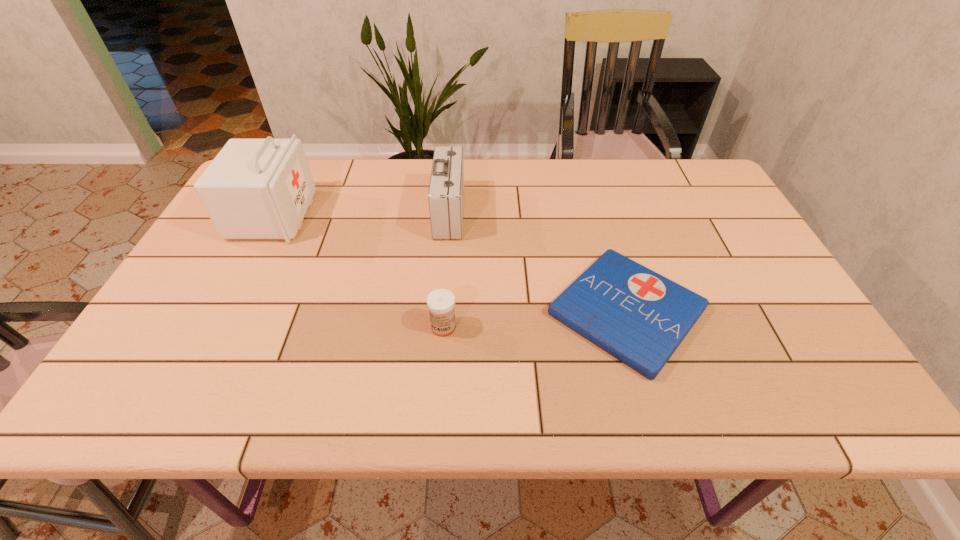
Select which object appears as the closest to the medicine. Please provide its 2D coordinates. Your answer should be formatted as a tuple, i.e. [(x, y)], where the tuple contains the x and y coordinates of a point satisfying the conditions above.

[(638, 316)]

Identify which first-aid kit is located as the nearest to the third tallest object. Please provide its 2D coordinates. Your answer should be formatted as a tuple, i.e. [(x, y)], where the tuple contains the x and y coordinates of a point satisfying the conditions above.

[(638, 316)]

The image size is (960, 540). What are the coordinates of `the first-aid kit object that ranks as the second closest to the medicine` in the screenshot? It's located at (446, 189).

Locate an element on the screen. This screenshot has width=960, height=540. free location that satisfies the following two spatial constraints: 1. on the front-facing side of the second first-aid kit from left to right; 2. on the right side of the medicine is located at coordinates (441, 327).

Identify the location of vacant point that satisfies the following two spatial constraints: 1. on the back side of the shortest object; 2. on the front-facing side of the third shortest object. Image resolution: width=960 pixels, height=540 pixels. (597, 213).

Locate an element on the screen. vacant position in the image that satisfies the following two spatial constraints: 1. on the front-facing side of the leftmost object; 2. on the back side of the nearest first-aid kit is located at coordinates (223, 311).

I want to click on free space that satisfies the following two spatial constraints: 1. on the front-facing side of the medicine; 2. on the right side of the second tallest object, so click(x=441, y=327).

Image resolution: width=960 pixels, height=540 pixels. Find the location of `vacant space that satisfies the following two spatial constraints: 1. on the front-facing side of the leftmost first-aid kit; 2. on the right side of the rightmost object`. vacant space that satisfies the following two spatial constraints: 1. on the front-facing side of the leftmost first-aid kit; 2. on the right side of the rightmost object is located at coordinates (223, 311).

The height and width of the screenshot is (540, 960). I want to click on free space in the image that satisfies the following two spatial constraints: 1. on the back side of the shortest object; 2. on the front-facing side of the third shortest object, so coord(597,213).

Image resolution: width=960 pixels, height=540 pixels. I want to click on vacant space that satisfies the following two spatial constraints: 1. on the front-facing side of the leftmost object; 2. on the left side of the medicine, so click(x=215, y=327).